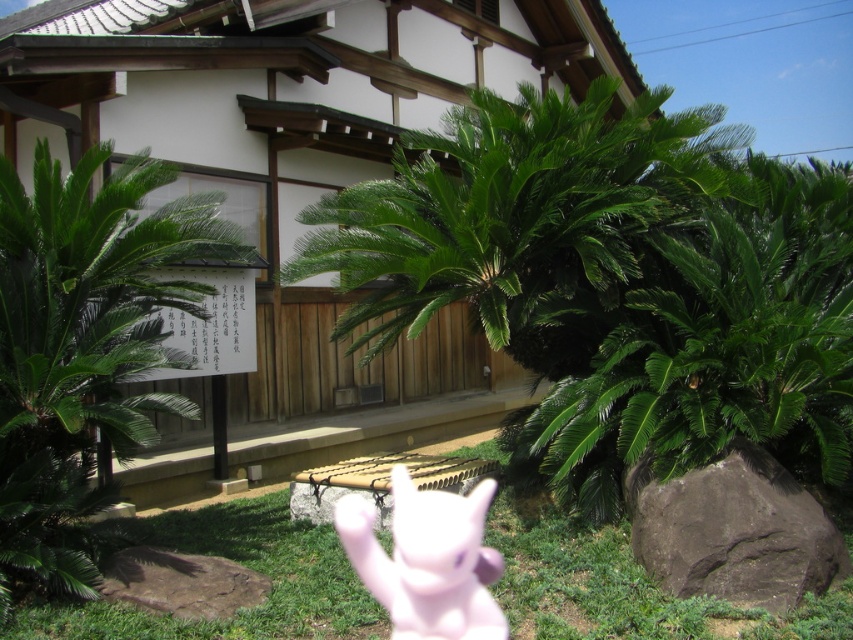
Which of these two, green leafy palm tree at left or green grass at lower center, stands taller?

green leafy palm tree at left is taller.

Who is positioned more to the left, green leafy palm tree at left or green grass at lower center?

green leafy palm tree at left is more to the left.

Find the location of `green leafy palm tree at left`. green leafy palm tree at left is located at coordinates (85, 348).

In the scene shown: Between green leafy palm tree at left and pink rubber toy at center, which one is positioned higher?

green leafy palm tree at left is above.

Can you confirm if green leafy palm tree at left is positioned below pink rubber toy at center?

Incorrect, green leafy palm tree at left is not positioned below pink rubber toy at center.

Who is more forward, [10,358] or [360,564]?

Point [10,358] is in front.

Identify the location of green leafy palm tree at left. (85, 348).

Is green grass at lower center further to the viewer compared to pink rubber toy at center?

No, green grass at lower center is closer to the viewer.

Consider the image. Who is lower down, green grass at lower center or pink rubber toy at center?

green grass at lower center is below.

Which is in front, point (74, 632) or point (361, 560)?

Point (74, 632) is in front.

Identify the location of green grass at lower center. (614, 584).